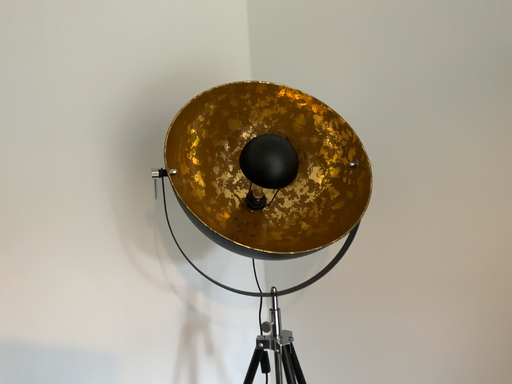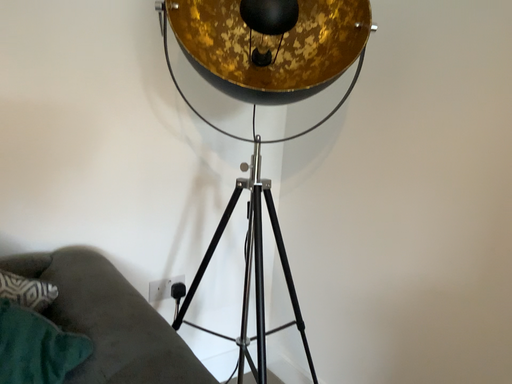
Question: How did the camera likely rotate when shooting the video?

Choices:
 (A) rotated upward
 (B) rotated downward

Answer: (B)